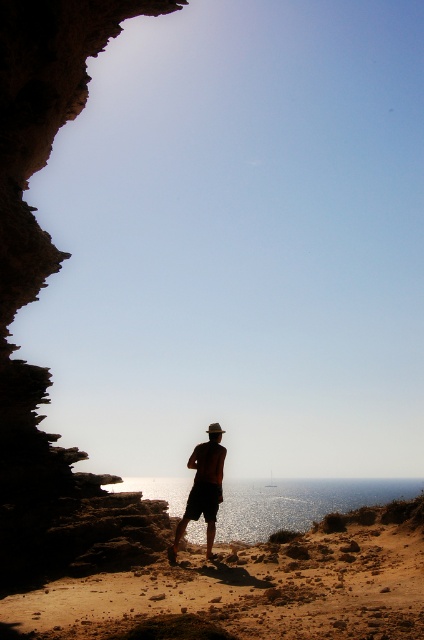
You are standing inside a cave looking out at a coastal view. You see a dark brown rocky cliff at left and a silhouette hat at center. Which object is located to the left of the other?

The dark brown rocky cliff at left is positioned on the left side of silhouette hat at center.

You are planning to set up a small tent on the brown sandy beach at lower center. Considering the position of the dark brown rocky cliff at left, will the cliff provide shade for your tent during the afternoon sun?

The brown sandy beach at lower center is positioned under the dark brown rocky cliff at left, so the cliff will cast a shadow over the beach. Since the sun is in the afternoon, the shadow from the dark brown rocky cliff at left would likely provide shade for the tent on the brown sandy beach at lower center.